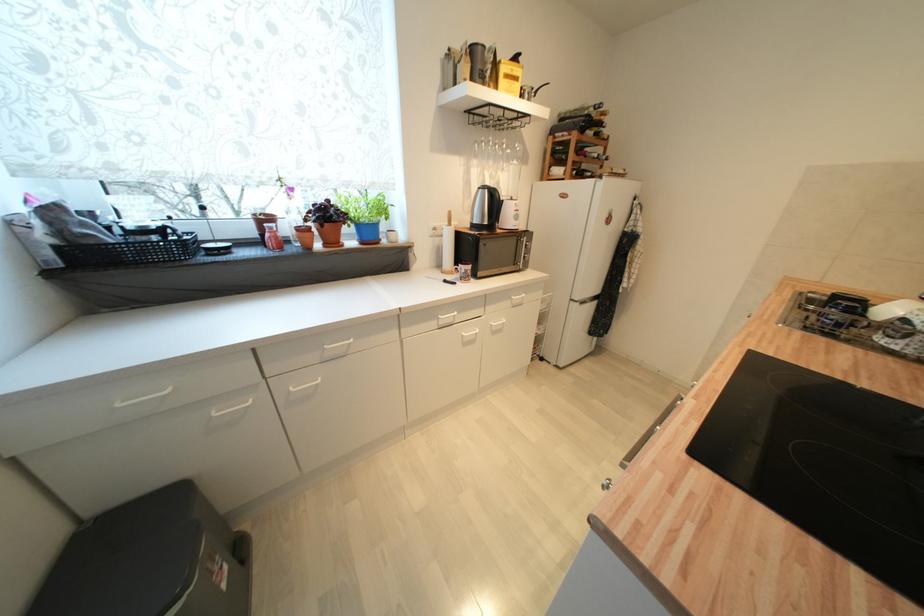
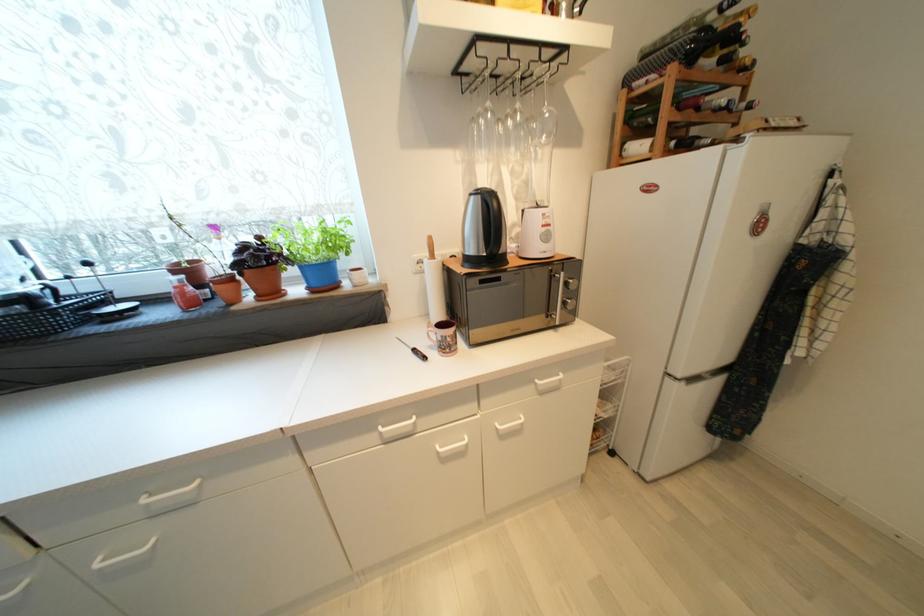
What movement of the cameraman would produce the second image?

The cameraman walked toward right, forward.